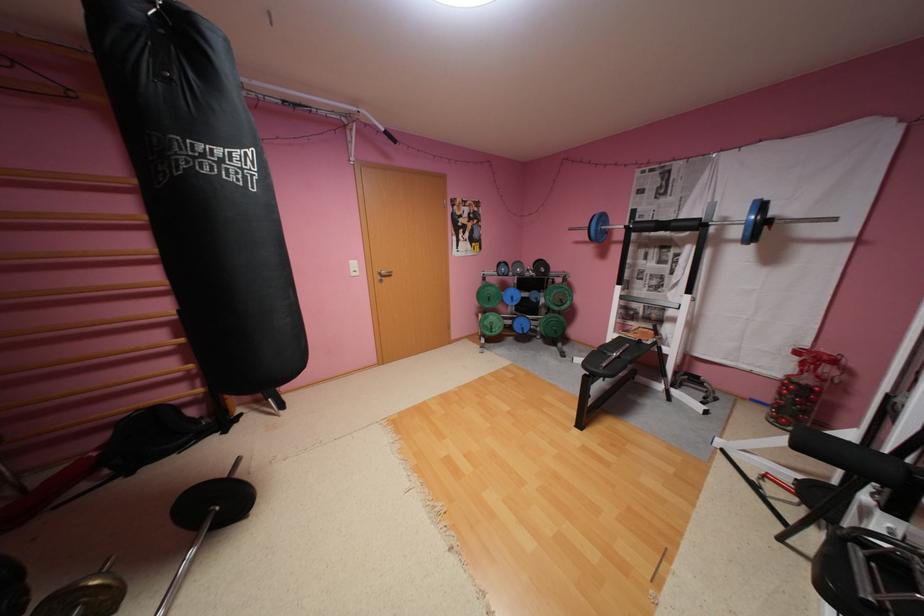
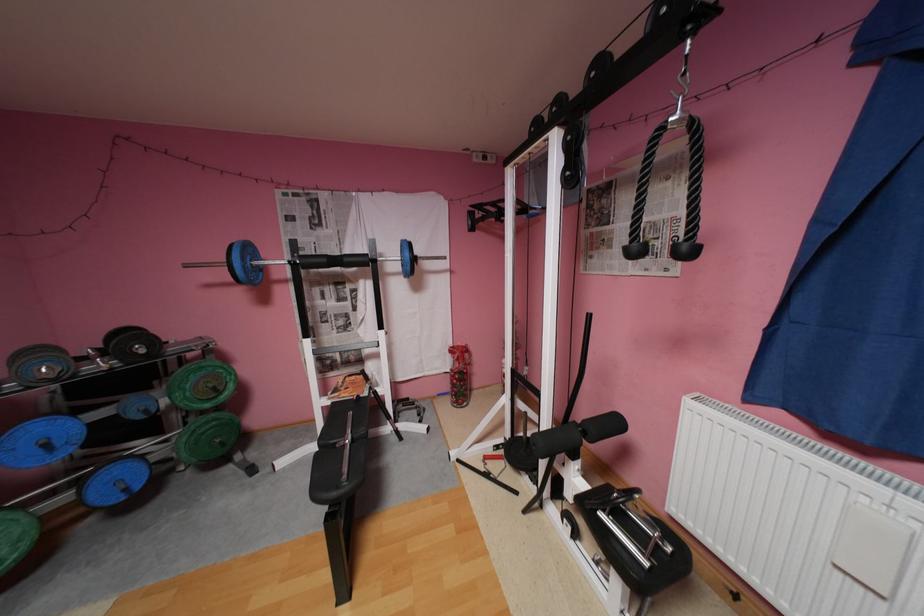
Locate, in the second image, the point that corresponds to point (793, 384) in the first image.

(462, 377)